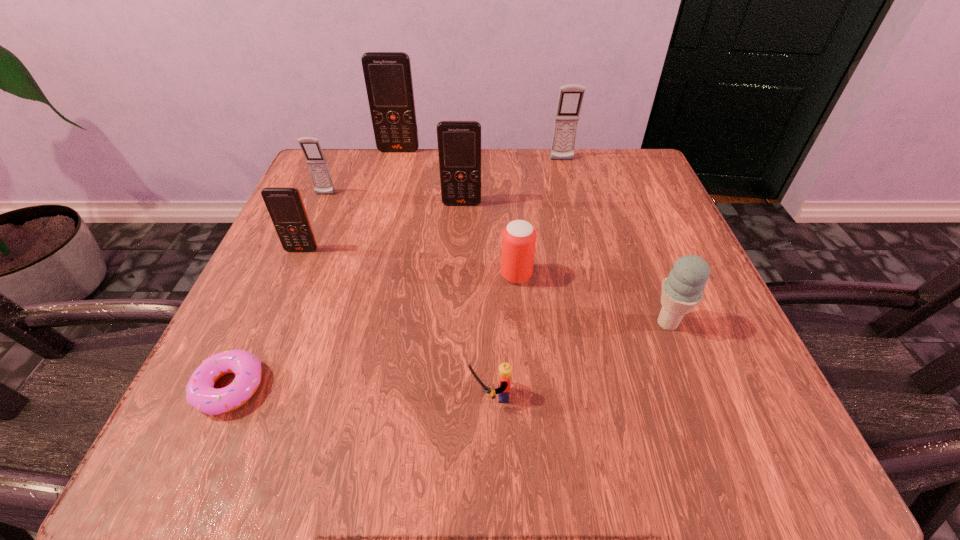
Where is `object that is the nearest to the farthest cellular telephone`? Image resolution: width=960 pixels, height=540 pixels. object that is the nearest to the farthest cellular telephone is located at coordinates (317, 164).

The height and width of the screenshot is (540, 960). I want to click on cellular telephone that is the fourth closest to the Lego, so click(x=571, y=96).

Locate which cellular telephone is the third closest to the rightmost object. Please provide its 2D coordinates. Your answer should be formatted as a tuple, i.e. [(x, y)], where the tuple contains the x and y coordinates of a point satisfying the conditions above.

[(285, 205)]

At what (x,y) coordinates should I click in order to perform the action: click on orange cellular telephone object that ranks as the second closest to the farthest object. Please return your answer as a coordinate pair (x, y). The width and height of the screenshot is (960, 540). Looking at the image, I should click on (285, 205).

Locate which orange cellular telephone is the second closest to the rightmost orange cellular telephone. Please provide its 2D coordinates. Your answer should be formatted as a tuple, i.e. [(x, y)], where the tuple contains the x and y coordinates of a point satisfying the conditions above.

[(285, 205)]

This screenshot has height=540, width=960. I want to click on free space that satisfies the following two spatial constraints: 1. on the screen of the beer can; 2. on the right side of the nearest orange cellular telephone, so click(x=291, y=275).